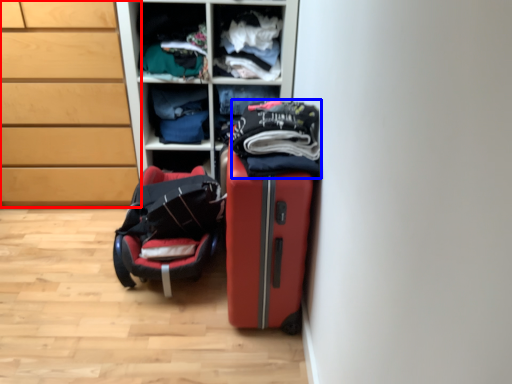
Question: Which point is closer to the camera, chest of drawers (highlighted by a red box) or clothing (highlighted by a blue box)?

Choices:
 (A) chest of drawers
 (B) clothing

Answer: (B)